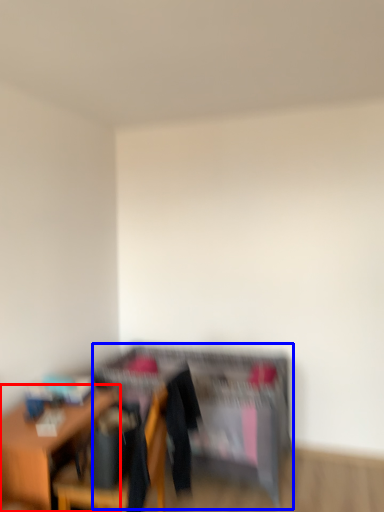
Question: Among these objects, which one is farthest to the camera, table (highlighted by a red box) or dresser (highlighted by a blue box)?

Choices:
 (A) table
 (B) dresser

Answer: (B)